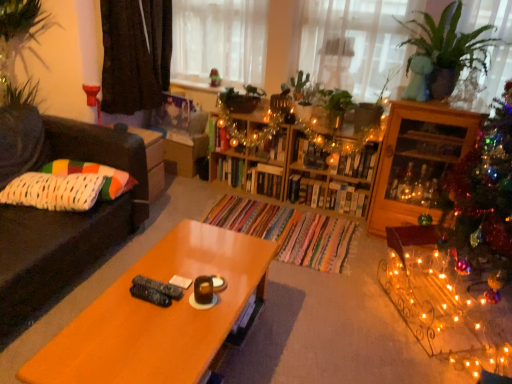
Question: Is green leafy plant at center in front of or behind white knitted pillow at left, which is the 1th pillow in front-to-back order, in the image?

Choices:
 (A) behind
 (B) front

Answer: (A)

Question: From a real-world perspective, is green leafy plant at center above or below white knitted pillow at left, marked as the 2th pillow in a back-to-front arrangement?

Choices:
 (A) above
 (B) below

Answer: (A)

Question: Which object is positioned farthest from the dark brown fabric at upper left?

Choices:
 (A) wooden coffee table at center
 (B) wooden bookshelf at center, arranged as the first shelf when viewed from the left
 (C) brown leather couch at left
 (D) green glossy plant at upper right
 (E) wooden bookshelf at center

Answer: (D)

Question: Considering the real-world distances, which object is closest to the wooden coffee table at center?

Choices:
 (A) translucent glass window at upper center
 (B) wooden bookshelf at center
 (C) white knitted pillow at left, marked as the 2th pillow in a back-to-front arrangement
 (D) wooden cabinet at right
 (E) multicolored fabric pillow at left, which is the first pillow in back-to-front order

Answer: (C)